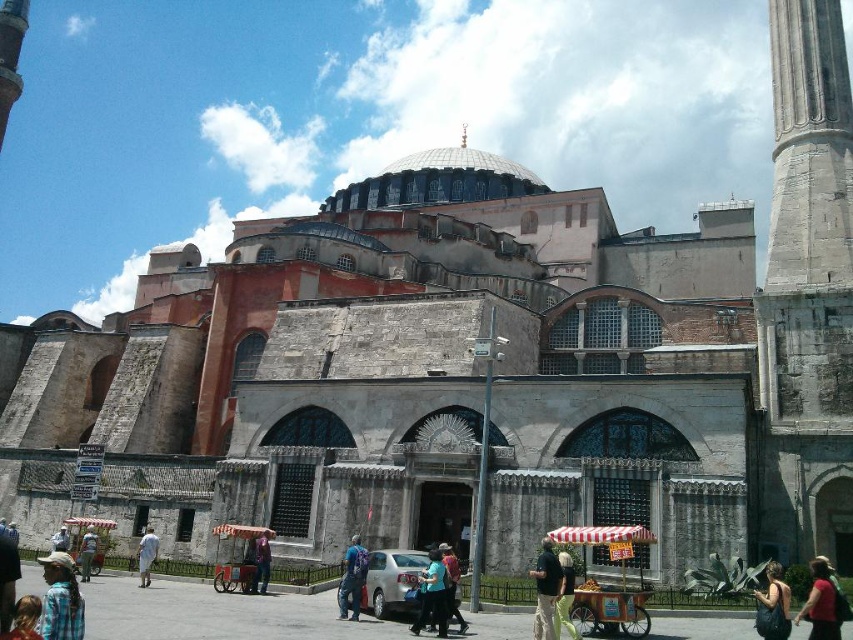
Question: Can you confirm if gray stone minaret at right is smaller than light blue denim jacket at lower left?

Choices:
 (A) yes
 (B) no

Answer: (B)

Question: Which is farther from the blue denim jeans at center?

Choices:
 (A) dark brown leather handbag at lower right
 (B) green fabric pants at lower center

Answer: (A)

Question: Does denim jacket at lower left appear on the left side of red fabric bag at center?

Choices:
 (A) no
 (B) yes

Answer: (B)

Question: Which object is positioned closest to the light blue fabric shirt at center?

Choices:
 (A) dark blue jeans at center
 (B) light blue denim shirt at lower left

Answer: (A)

Question: Among these objects, which one is farthest from the camera?

Choices:
 (A) light blue fabric shirt at center
 (B) blue denim jeans at center
 (C) white cotton shirt at lower left

Answer: (C)

Question: Can you confirm if dark brown leather handbag at lower right is positioned below light blue fabric shirt at center?

Choices:
 (A) no
 (B) yes

Answer: (A)